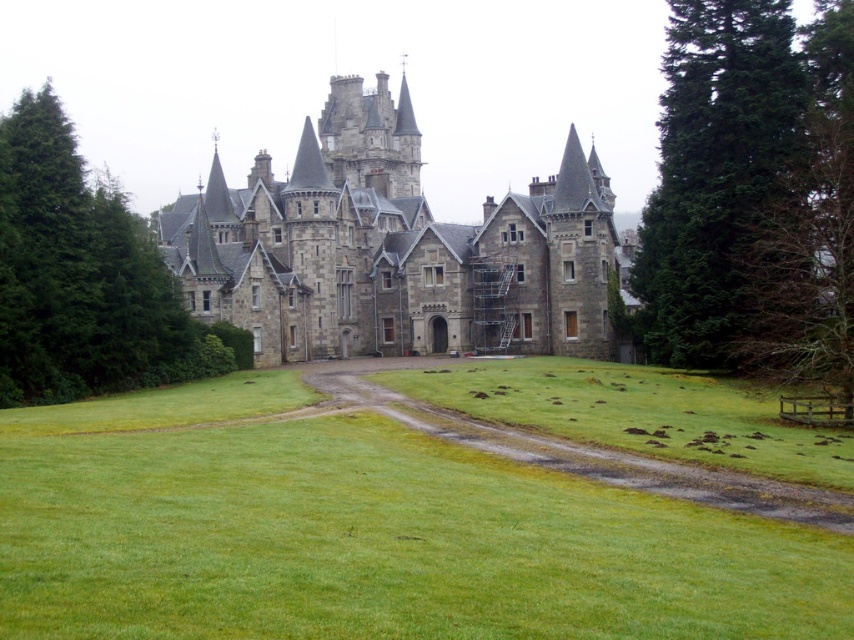
Describe the element at coordinates (395, 248) in the screenshot. I see `gray stone castle at center` at that location.

Is point (344, 202) positioned in front of point (151, 262)?

No, (344, 202) is behind (151, 262).

You are a GUI agent. You are given a task and a screenshot of the screen. Output one action in this format:
    pyautogui.click(x=<x>, y=<y>)
    Task: Click on the gray stone castle at center
    
    Given the screenshot: What is the action you would take?
    pyautogui.click(x=395, y=248)

Does gray stone castle at center have a greater width compared to green coniferous tree at right?

Yes.

Can you confirm if gray stone castle at center is thinner than green coniferous tree at right?

No.

Is point (332, 317) farther from camera compared to point (686, 244)?

Yes, it is behind point (686, 244).

Find the location of `gray stone castle at center`. gray stone castle at center is located at coordinates (395, 248).

Does green grass at center have a lesser height compared to gray stone castle at center?

Indeed, green grass at center has a lesser height compared to gray stone castle at center.

Describe the element at coordinates (364, 532) in the screenshot. The width and height of the screenshot is (854, 640). I see `green grass at center` at that location.

Between point (264, 616) and point (542, 282), which one is positioned behind?

Point (542, 282)

Find the location of a particular element. Image resolution: width=854 pixels, height=640 pixels. green grass at center is located at coordinates (364, 532).